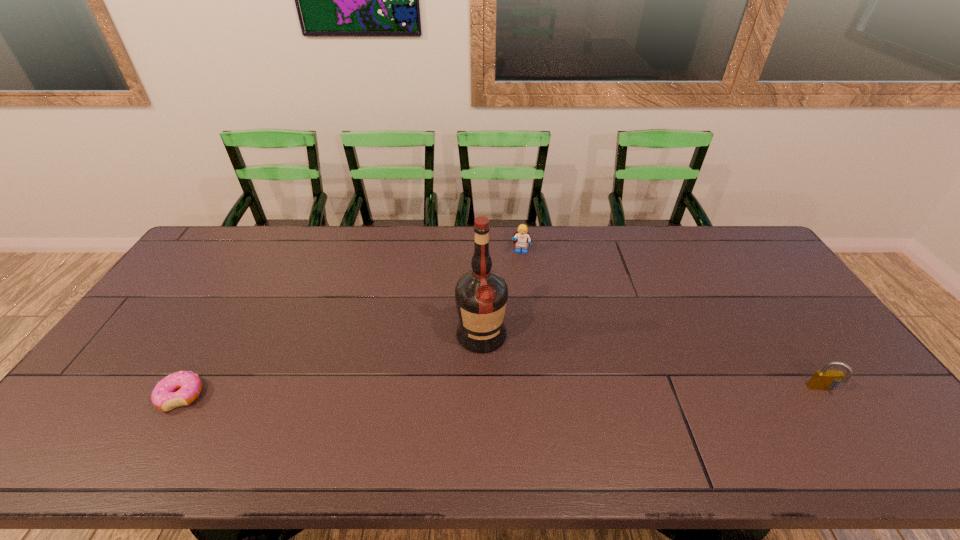
The width and height of the screenshot is (960, 540). In order to click on vacant space on the desktop that is between the leftmost object and the rightmost object and is positioned on the surface of the tallest object in this screenshot , I will do `click(494, 393)`.

Locate an element on the screen. vacant space on the desktop that is between the leftmost object and the rightmost object and is positioned on the front-facing side of the farthest object is located at coordinates (510, 393).